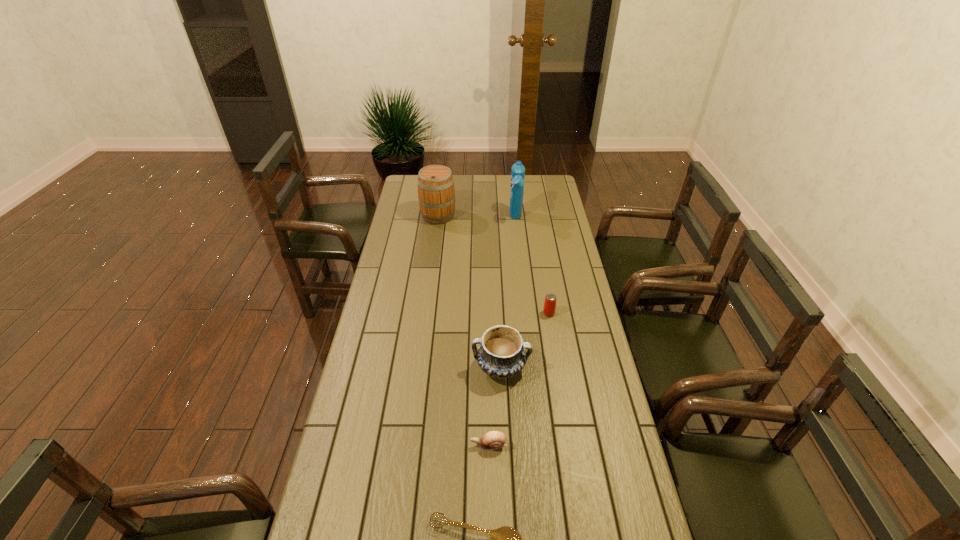
Identify the location of shampoo. (518, 170).

Where is `cider`? Image resolution: width=960 pixels, height=540 pixels. cider is located at coordinates (436, 193).

Find the location of a particular element. This screenshot has width=960, height=540. the fourth farthest object is located at coordinates (501, 354).

This screenshot has width=960, height=540. In order to click on pottery in this screenshot , I will do `click(501, 354)`.

Where is `the rightmost object`? the rightmost object is located at coordinates (549, 308).

Find the location of a particular element. the fourth tallest object is located at coordinates (549, 308).

In order to click on escargot in this screenshot , I will do `click(492, 440)`.

You are a GUI agent. You are given a task and a screenshot of the screen. Output one action in this format:
    pyautogui.click(x=<x>, y=<y>)
    Task: Click on the second shortest object
    Image resolution: width=960 pixels, height=540 pixels.
    Given the screenshot: What is the action you would take?
    pyautogui.click(x=492, y=440)

Identify the location of free space located 0.100m on the right of the shampoo. (542, 219).

Where is `vacant area situated 0.070m on the front of the fifth shortest object`? Image resolution: width=960 pixels, height=540 pixels. vacant area situated 0.070m on the front of the fifth shortest object is located at coordinates (436, 234).